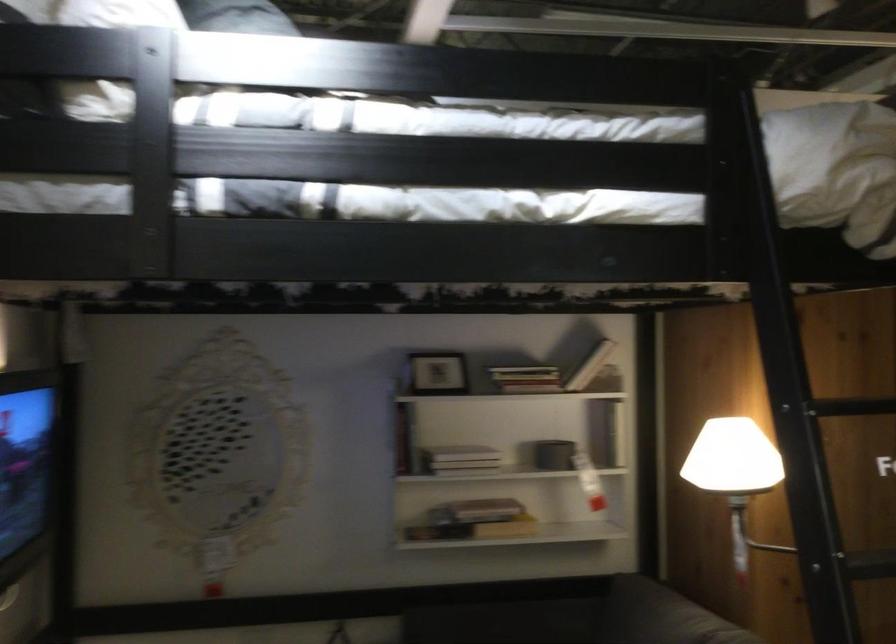
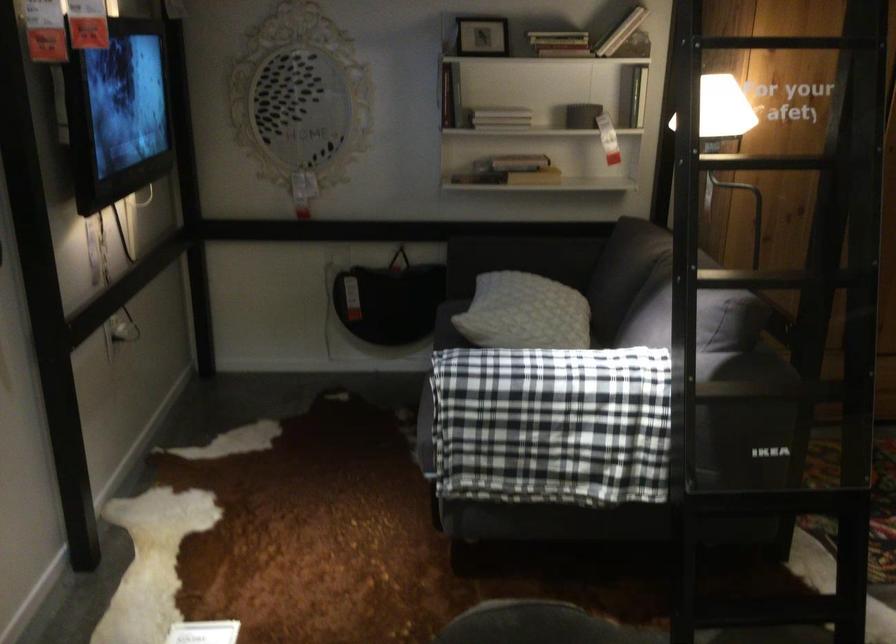
The point at [478,536] is marked in the first image. Where is the corresponding point in the second image?

(509, 171)